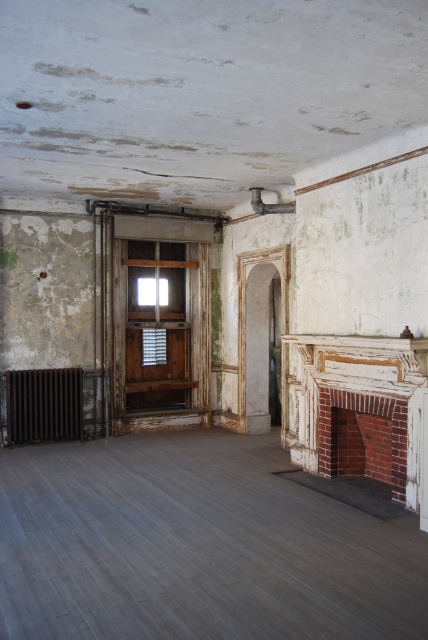
Between brick fireplace at right and rusty metal radiator at lower left, which one appears on the right side from the viewer's perspective?

Positioned to the right is brick fireplace at right.

Does point (407, 465) come farther from viewer compared to point (27, 406)?

No, (407, 465) is closer to viewer.

Find the location of a particular element. brick fireplace at right is located at coordinates (363, 408).